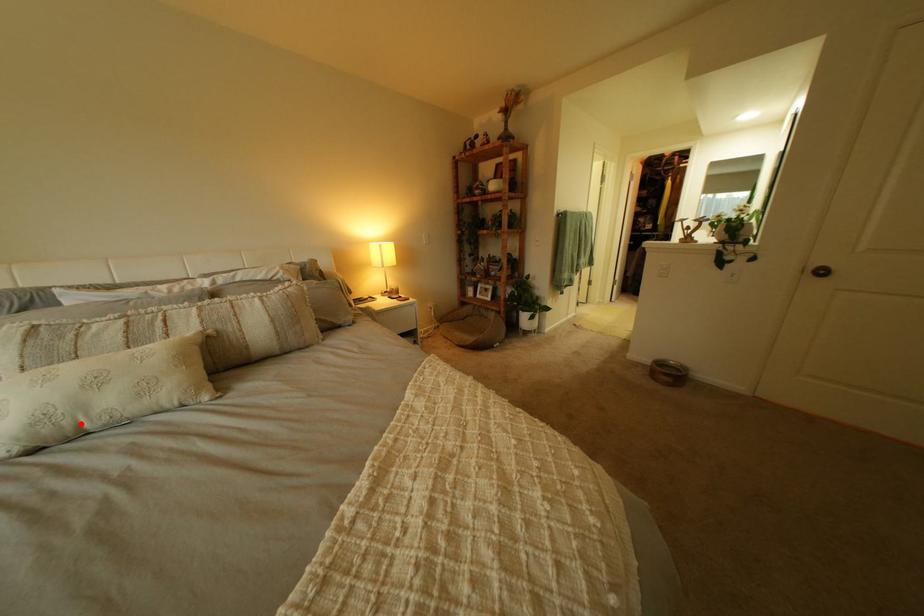
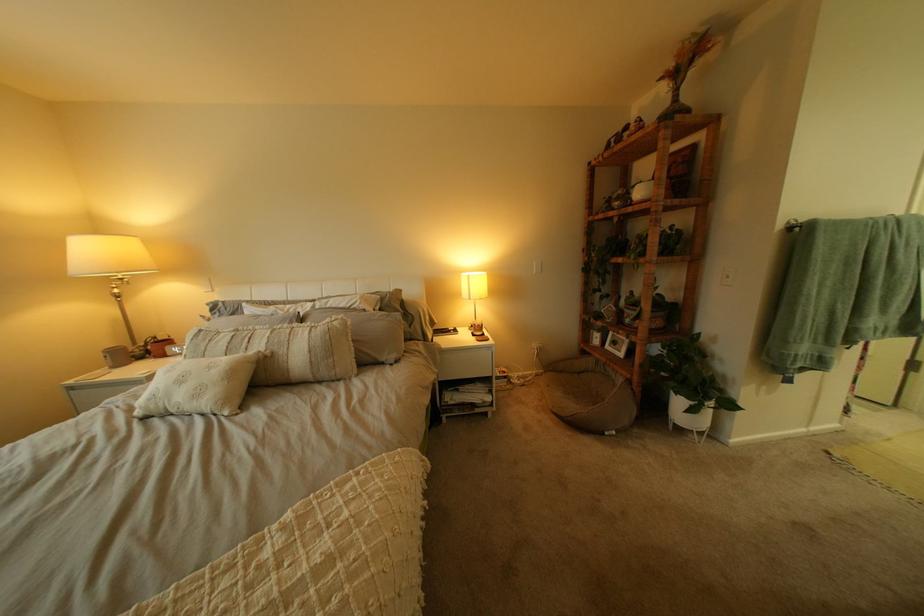
Where in the second image is the point corresponding to the highlighted location from the first image?

(176, 405)